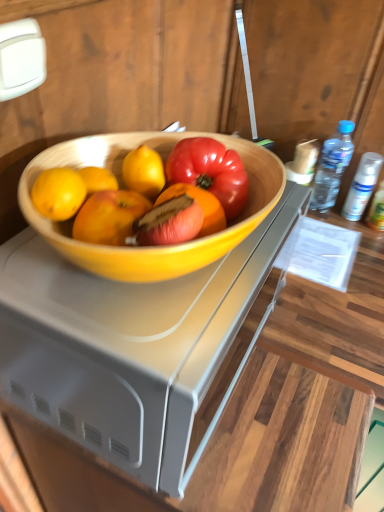
Find the location of a particular element. The image size is (384, 512). vacant area in front of clear plastic spray can at upper right, which is the 1th bottle in right-to-left order is located at coordinates (x=364, y=257).